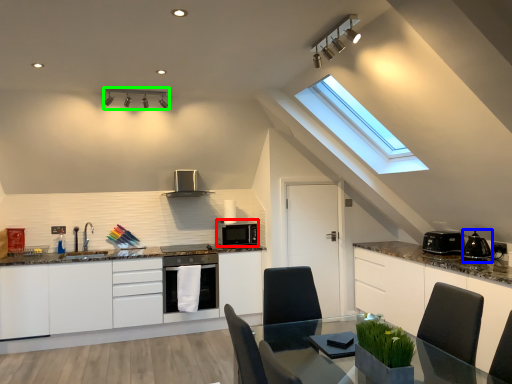
Question: Which is nearer to the kitchen appliance (highlighted by a red box)? appliance (highlighted by a blue box) or light fixture (highlighted by a green box).

Choices:
 (A) appliance
 (B) light fixture

Answer: (B)